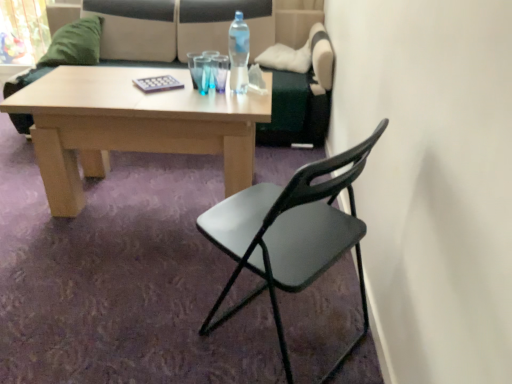
Question: Can you confirm if black plastic chair at center is thinner than green fuzzy pillow at upper left?

Choices:
 (A) no
 (B) yes

Answer: (A)

Question: Does black plastic chair at center appear on the left side of green fuzzy pillow at upper left?

Choices:
 (A) no
 (B) yes

Answer: (A)

Question: From a real-world perspective, is black plastic chair at center over green fuzzy pillow at upper left?

Choices:
 (A) no
 (B) yes

Answer: (A)

Question: Is the position of black plastic chair at center more distant than that of green fuzzy pillow at upper left?

Choices:
 (A) yes
 (B) no

Answer: (B)

Question: From a real-world perspective, does black plastic chair at center sit lower than green fuzzy pillow at upper left?

Choices:
 (A) yes
 (B) no

Answer: (A)

Question: Is white fabric towel at center inside or outside of transparent glass at center?

Choices:
 (A) outside
 (B) inside

Answer: (A)

Question: Considering the positions of white fabric towel at center and transparent glass at center in the image, is white fabric towel at center taller or shorter than transparent glass at center?

Choices:
 (A) tall
 (B) short

Answer: (B)

Question: From the image's perspective, is white fabric towel at center positioned above or below transparent glass at center?

Choices:
 (A) above
 (B) below

Answer: (B)

Question: Is point (250, 77) positioned closer to the camera than point (221, 76)?

Choices:
 (A) farther
 (B) closer

Answer: (B)

Question: Is point (245, 59) positioned closer to the camera than point (228, 314)?

Choices:
 (A) closer
 (B) farther

Answer: (B)

Question: Is clear plastic bottle at center inside the boundaries of black plastic chair at center, or outside?

Choices:
 (A) outside
 (B) inside

Answer: (A)

Question: Considering the positions of clear plastic bottle at center and black plastic chair at center in the image, is clear plastic bottle at center taller or shorter than black plastic chair at center?

Choices:
 (A) short
 (B) tall

Answer: (A)

Question: In terms of width, does clear plastic bottle at center look wider or thinner when compared to black plastic chair at center?

Choices:
 (A) wide
 (B) thin

Answer: (B)

Question: Is point (145, 11) positioned closer to the camera than point (254, 66)?

Choices:
 (A) farther
 (B) closer

Answer: (A)

Question: Relative to white fabric towel at center, is beige fabric couch at upper center in front or behind?

Choices:
 (A) behind
 (B) front

Answer: (A)